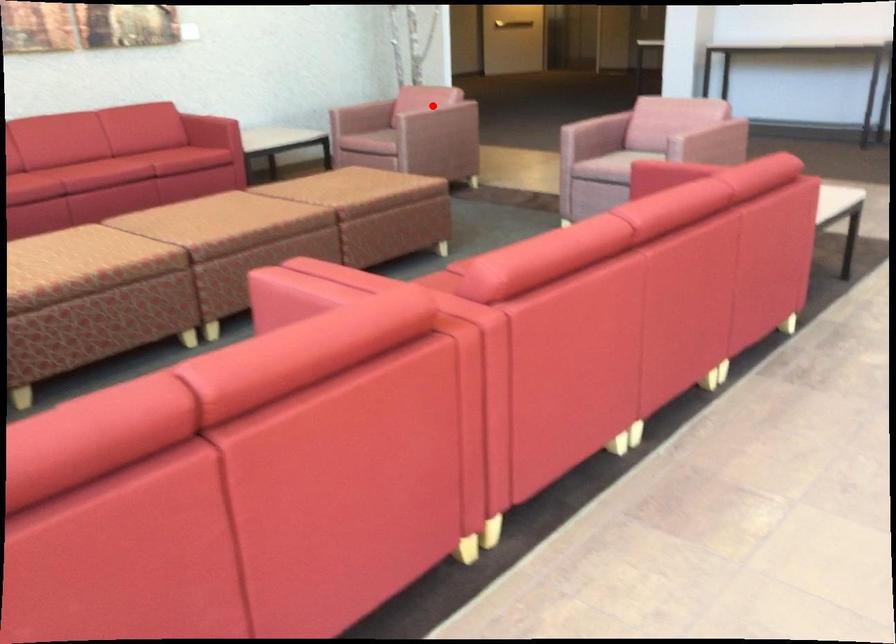
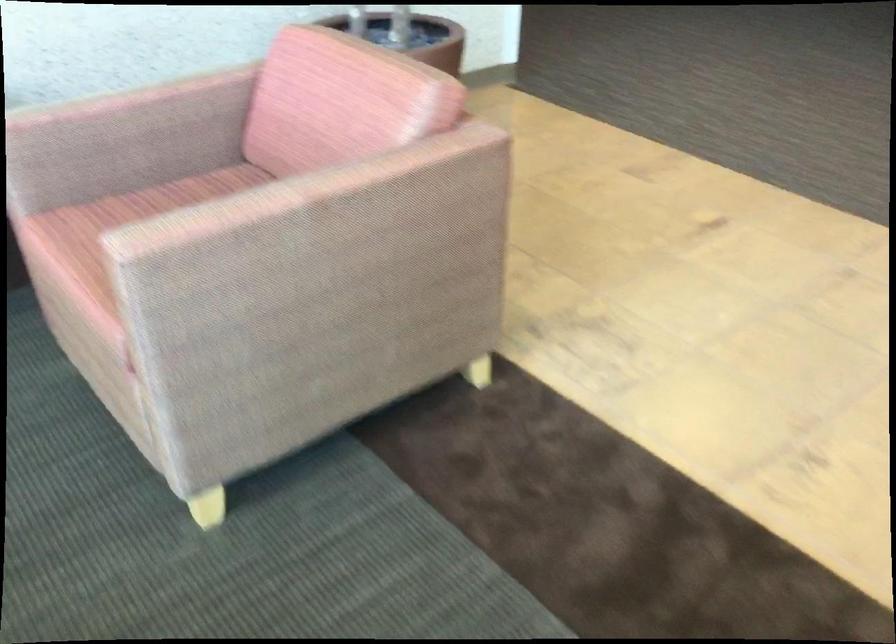
Find the pixel in the second image that matches the highlighted location in the first image.

(298, 192)